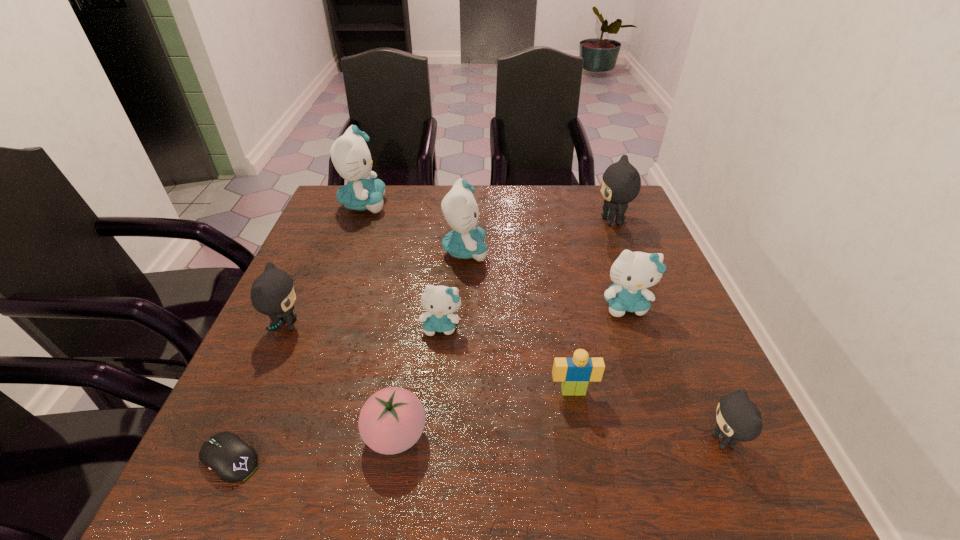
This screenshot has height=540, width=960. Identify the location of free space located 0.090m on the face of the rightmost blue kitten. (642, 353).

Where is `vacant area situated on the front-facing side of the second biggest gray kitten`? vacant area situated on the front-facing side of the second biggest gray kitten is located at coordinates (332, 325).

The width and height of the screenshot is (960, 540). In order to click on blank space located 0.260m on the face of the smallest blue kitten in this screenshot , I will do `click(430, 456)`.

Find the location of a particular element. vacant space located on the face of the seventh farthest object is located at coordinates (580, 426).

At what (x,y) coordinates should I click in order to perform the action: click on vacant space situated 0.280m on the front-facing side of the nearest gray kitten. Please return your answer as a coordinate pair (x, y). Looking at the image, I should click on (545, 441).

Find the location of `free location located 0.290m on the front-facing side of the nearest gray kitten`. free location located 0.290m on the front-facing side of the nearest gray kitten is located at coordinates (540, 441).

Locate an element on the screen. This screenshot has height=540, width=960. vacant area situated 0.290m on the front-facing side of the nearest gray kitten is located at coordinates (540, 441).

You are a GUI agent. You are given a task and a screenshot of the screen. Output one action in this format:
    pyautogui.click(x=<x>, y=<y>)
    Task: Click on the vacant point located 0.270m on the back of the red tomato
    The image size is (960, 540).
    Given the screenshot: What is the action you would take?
    [x=416, y=305]

Find the location of a particular element. vacant region located on the back of the computer equipment is located at coordinates (307, 283).

You are a GUI agent. You are given a task and a screenshot of the screen. Output one action in this format:
    pyautogui.click(x=<x>, y=<y>)
    Task: Click on the kitten positioned at the near edge
    
    Given the screenshot: What is the action you would take?
    pyautogui.click(x=738, y=419)